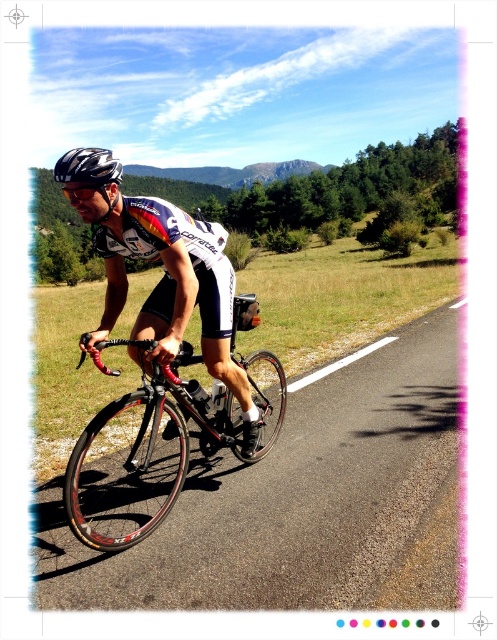
You are a photographer positioned at the point with coordinates (167, 436) in the image. You want to capture a photo of the shiny black frame at center. Is your current position directly in front of the shiny black frame at center?

The point at coordinates (167, 436) corresponds to the shiny black frame at center, so yes, your current position is directly in front of the shiny black frame at center.

You are a photographer trying to capture the cyclist and their bike. You notice the matte black bicycle at center and the shiny black frame at center. Which object should you focus on if you want to photograph the one that is more to the left?

The matte black bicycle at center is positioned on the left side of the shiny black frame at center, so you should focus on the matte black bicycle at center to capture the one more to the left.

You are standing on the road where the cyclist is riding and want to place a small cone at the two points marked as point (x=118, y=269) and point (x=162, y=508). Which point is closer to you when you are facing the direction the cyclist is moving?

Point (x=118, y=269) is closer to you because it is further to the viewer than point (x=162, y=508), meaning it is nearer in the line of sight.